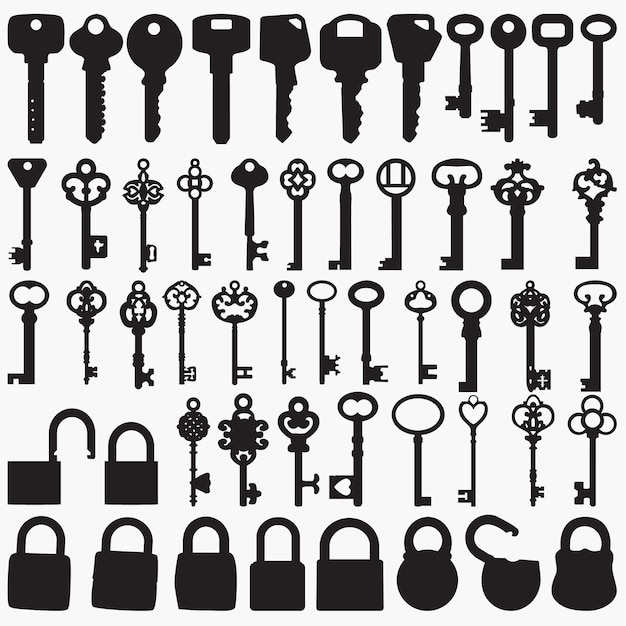
What are the coordinates of `locks` in the screenshot? It's located at (59, 486), (124, 488), (43, 577), (131, 578), (206, 588), (290, 590), (350, 588), (419, 587), (506, 587), (593, 578).